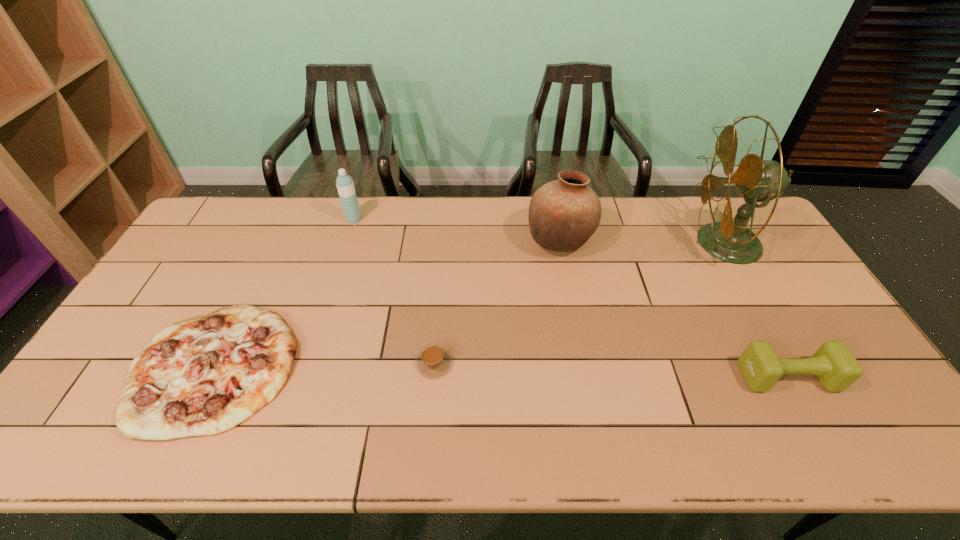
The width and height of the screenshot is (960, 540). Find the location of `object that is at the left edge`. object that is at the left edge is located at coordinates (203, 376).

Identify the location of fan at the right edge. (757, 180).

Find the location of a particular element. This screenshot has height=540, width=960. dumbbell present at the right edge is located at coordinates (836, 368).

This screenshot has width=960, height=540. What are the coordinates of `object present at the near left corner` in the screenshot? It's located at (203, 376).

You are a GUI agent. You are given a task and a screenshot of the screen. Output one action in this format:
    pyautogui.click(x=<x>, y=<y>)
    Task: Click on the object that is at the far right corner
    
    Given the screenshot: What is the action you would take?
    pyautogui.click(x=757, y=180)

This screenshot has width=960, height=540. Find the location of `blank space at the far edge of the desktop`. blank space at the far edge of the desktop is located at coordinates (645, 208).

This screenshot has width=960, height=540. Find the location of `blank space at the near edge`. blank space at the near edge is located at coordinates (285, 438).

Find the location of `vacant area at the left edge of the desktop`. vacant area at the left edge of the desktop is located at coordinates (202, 247).

I want to click on free region at the far left corner of the desktop, so click(237, 205).

Find the location of a particular element. vacant space at the near right corner of the desktop is located at coordinates (882, 421).